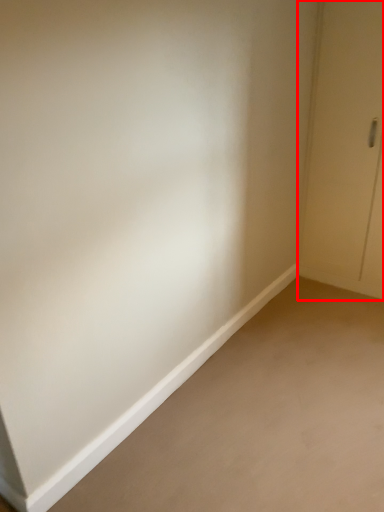
Question: From the image's perspective, what is the correct spatial relationship of door (annotated by the red box) in relation to plain?

Choices:
 (A) below
 (B) above

Answer: (B)